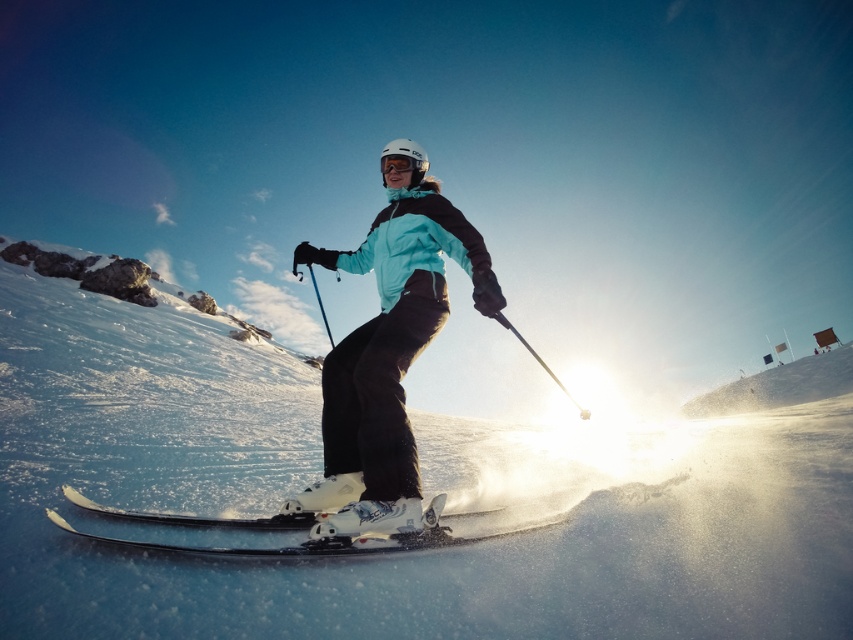
Question: Among these points, which one is farthest from the camera?

Choices:
 (A) (509, 324)
 (B) (296, 520)

Answer: (A)

Question: Can you confirm if matte blue jacket at center is wider than shiny metallic skis at center?

Choices:
 (A) no
 (B) yes

Answer: (A)

Question: Among these objects, which one is farthest from the camera?

Choices:
 (A) metallic silver ski pole at center
 (B) white powder snow at center
 (C) transparent plastic goggles at center

Answer: (C)

Question: Which point is farther to the camera?

Choices:
 (A) (341, 476)
 (B) (15, 536)

Answer: (A)

Question: Does white powder snow at center have a greater width compared to matte blue jacket at center?

Choices:
 (A) no
 (B) yes

Answer: (B)

Question: Does white powder snow at center come in front of metallic silver ski pole at center?

Choices:
 (A) yes
 (B) no

Answer: (A)